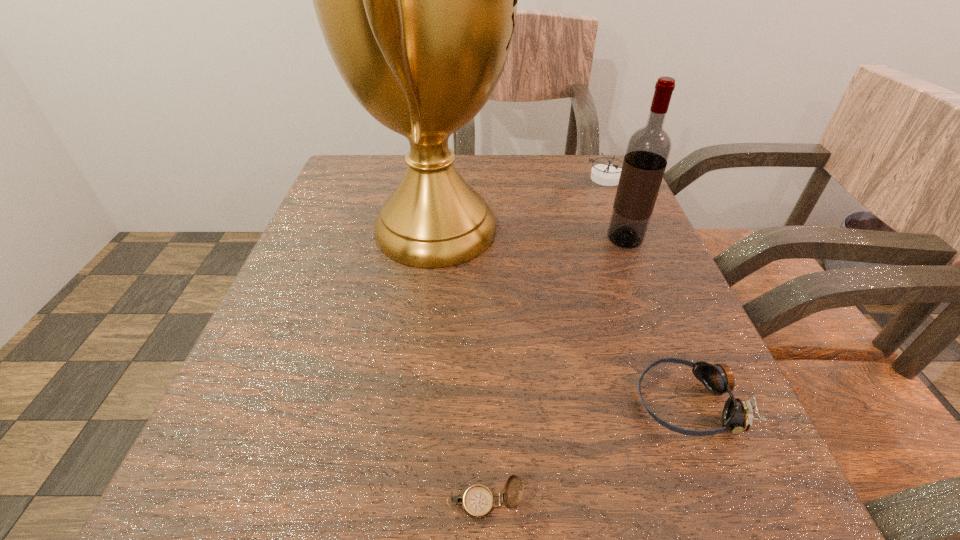
Identify the location of compass present at the right edge. This screenshot has width=960, height=540. (604, 174).

You are a GUI agent. You are given a task and a screenshot of the screen. Output one action in this format:
    pyautogui.click(x=<x>, y=<y>)
    Task: Click on the goggles at the right edge
    
    Given the screenshot: What is the action you would take?
    pyautogui.click(x=738, y=414)

What are the coordinates of `object located at the far left corner` in the screenshot? It's located at (416, 0).

The height and width of the screenshot is (540, 960). In order to click on object located at the far right corner in this screenshot , I will do `click(604, 174)`.

Locate an element on the screen. vacant point at the far edge is located at coordinates (519, 204).

In the image, there is a desktop. Where is `vacant space at the near edge`? The width and height of the screenshot is (960, 540). vacant space at the near edge is located at coordinates (390, 494).

Locate an element on the screen. free location at the left edge is located at coordinates (300, 254).

Where is `free space at the right edge of the desktop`? This screenshot has width=960, height=540. free space at the right edge of the desktop is located at coordinates (633, 248).

In the image, there is a desktop. Where is `free space at the far left corner`? free space at the far left corner is located at coordinates (393, 171).

I want to click on vacant space at the near left corner, so click(268, 497).